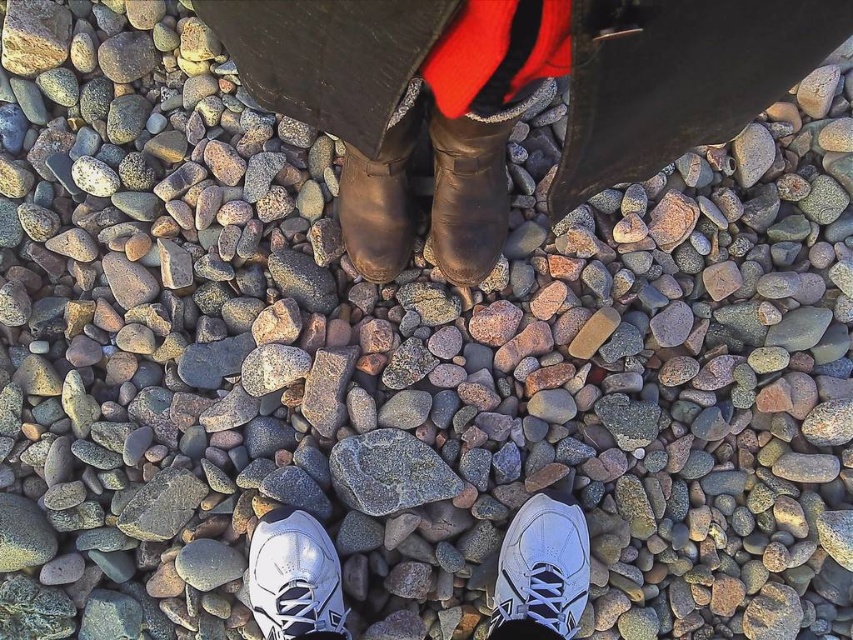
Based on the coordinates provided, which object is located at point (509,96)?

The point (509,96) indicates the location of the leather boots at center.

You are standing on a rocky path and notice two pairs of footwear. The leather boots at center and the white mesh shoe at lower center. Which footwear is positioned higher relative to the other?

The leather boots at center is located above the white mesh shoe at lower center.

Consider the image. You are standing in a rocky area and see the leather boots at center and the rusty metallic rock at center. Which object is closer to you?

The leather boots at center are closer to the viewer than the rusty metallic rock at center.